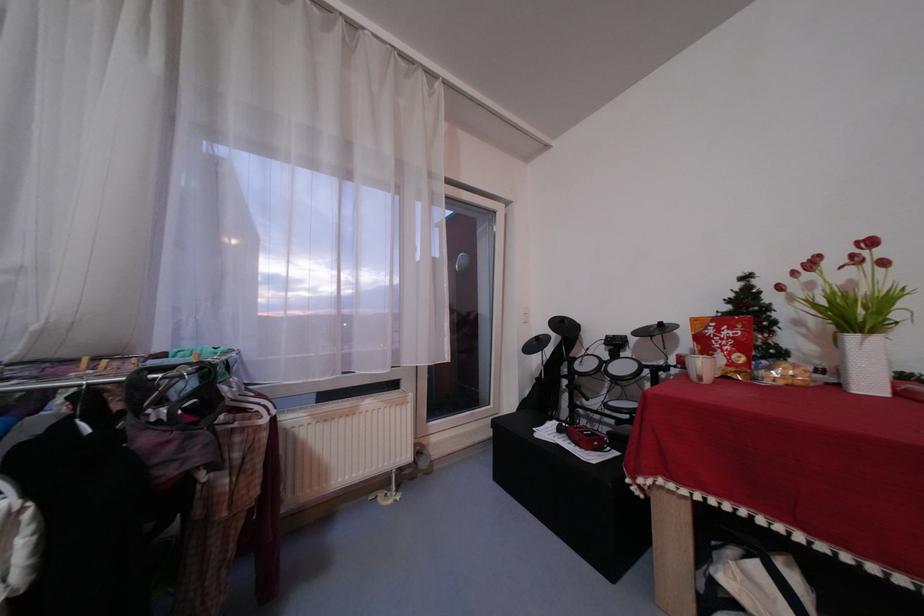
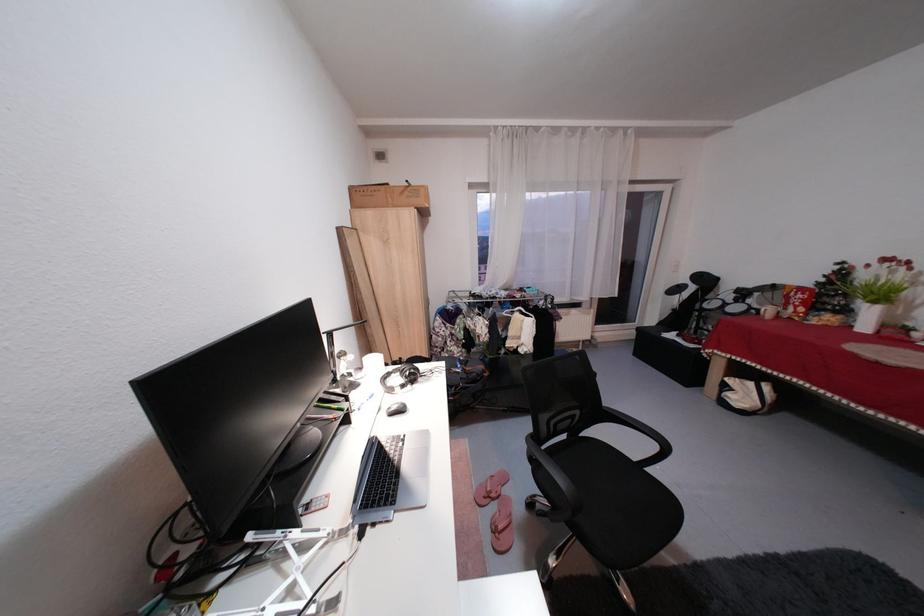
Locate, in the second image, the point that corresponds to [616,358] in the first image.

(742, 302)